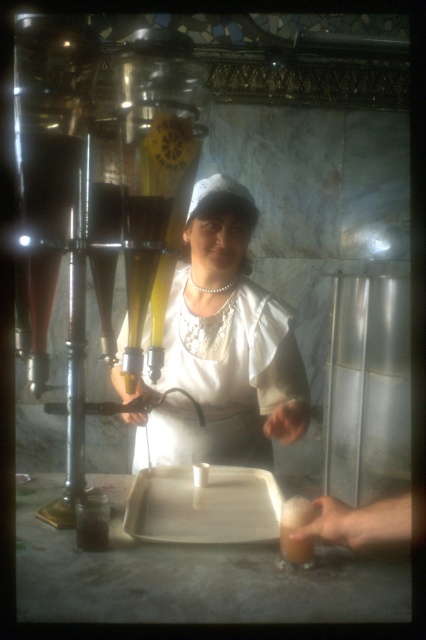
You are a customer at the bar and want to place your phone on the counter. The phone is 15 cm wide. Can the white fabric apron at center and the translucent glass drink at lower center accommodate the phone between them?

The white fabric apron at center is wider than the translucent glass drink at lower center. However, the exact distance between them isn not specified. Without knowing the space between the two objects, it is uncertain if the phone will fit.

You are a customer at the bar and want to grab the translucent glass drink at lower center. Which side of the white fabric apron at center should you approach from to reach the drink?

The white fabric apron at center is to the left of the translucent glass drink at lower center, so you should approach from the right side of the white fabric apron at center to reach the drink.

Consider the image. You are a customer at the bar and want to grab the translucent glass drink at lower center. Can you reach it without moving the white fabric apron at center?

The white fabric apron at center is positioned over the translucent glass drink at lower center, so you cannot reach the drink without moving the apron first.